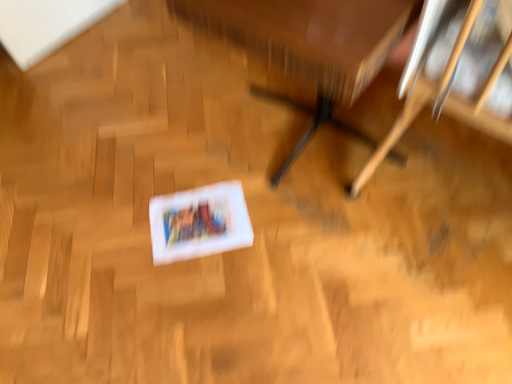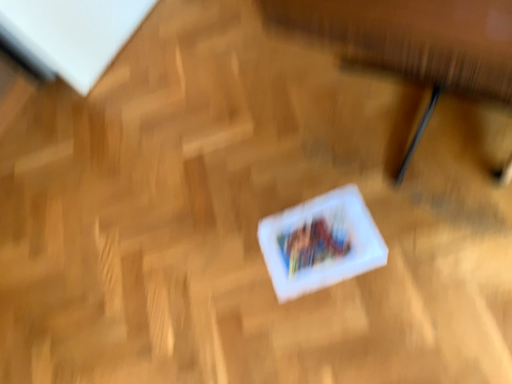
Question: Which way did the camera rotate in the video?

Choices:
 (A) rotated right
 (B) rotated left

Answer: (B)